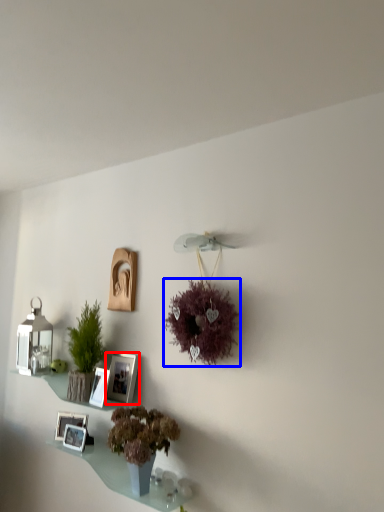
Question: Which object appears closest to the camera in this image, picture frame (highlighted by a red box) or flower (highlighted by a blue box)?

Choices:
 (A) picture frame
 (B) flower

Answer: (B)